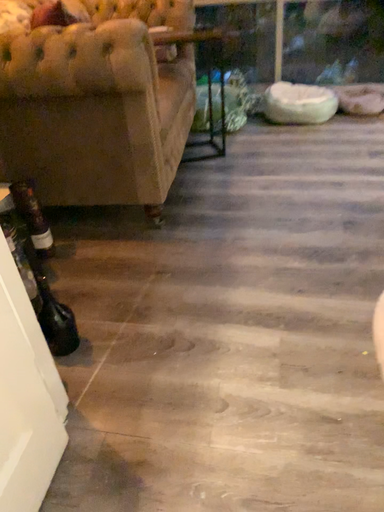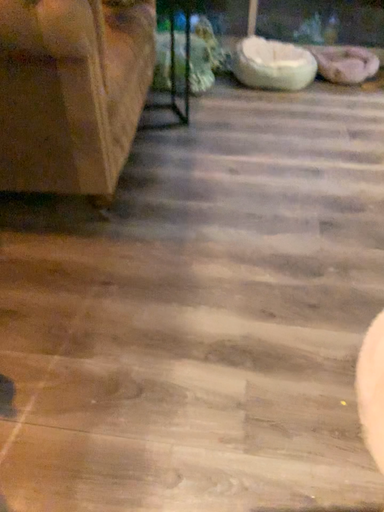
Question: How did the camera likely rotate when shooting the video?

Choices:
 (A) rotated upward
 (B) rotated downward

Answer: (B)